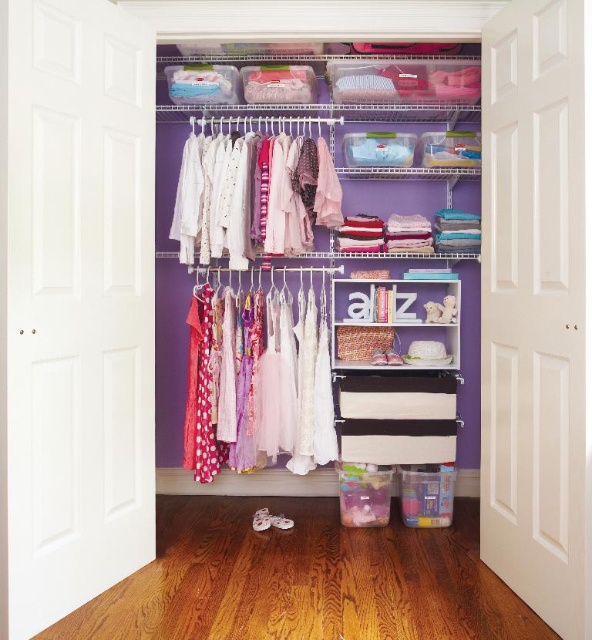
Question: Which object appears farthest from the camera in this image?

Choices:
 (A) matte white shirts at center
 (B) white matte shelf at center
 (C) matte plastic storage bins at upper center
 (D) polka dot fabric dresses at center

Answer: (B)

Question: Where is polka dot fabric dresses at center located in relation to white matte shelf at center in the image?

Choices:
 (A) left
 (B) right

Answer: (A)

Question: Is polka dot fabric dresses at center closer to camera compared to white matte shelf at center?

Choices:
 (A) no
 (B) yes

Answer: (B)

Question: Considering the real-world distances, which object is farthest from the matte white shirts at center?

Choices:
 (A) white matte shelf at center
 (B) polka dot fabric dresses at center
 (C) matte plastic storage bins at upper center

Answer: (A)

Question: Which object is farther from the camera taking this photo?

Choices:
 (A) polka dot fabric dresses at center
 (B) white matte shelf at center

Answer: (B)

Question: Considering the relative positions of matte plastic storage bins at upper center and polka dot fabric dresses at center in the image provided, where is matte plastic storage bins at upper center located with respect to polka dot fabric dresses at center?

Choices:
 (A) right
 (B) left

Answer: (A)